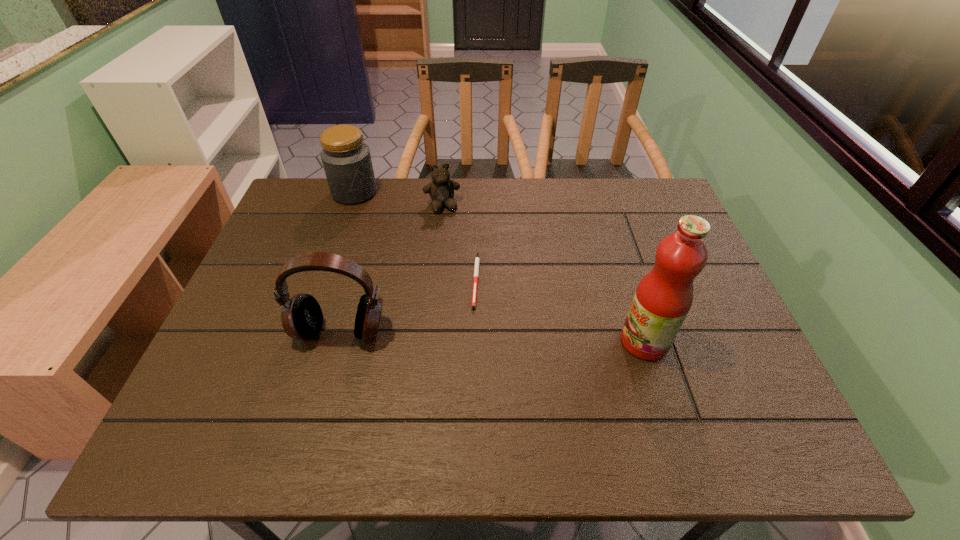
The width and height of the screenshot is (960, 540). I want to click on vacant space on the desktop that is between the headset and the fruit juice and is positioned on the face of the teddy bear, so click(478, 336).

You are a GUI agent. You are given a task and a screenshot of the screen. Output one action in this format:
    pyautogui.click(x=<x>, y=<y>)
    Task: Click on the free spot on the desktop that is between the headset and the tallest object and is positioned on the clicker of the shortest object
    The width and height of the screenshot is (960, 540).
    Given the screenshot: What is the action you would take?
    pyautogui.click(x=518, y=337)

At what (x,y) coordinates should I click in order to perform the action: click on free spot on the desktop that is between the headset and the rightmost object and is positioned on the surface of the jar near the warning symbol. Please return your answer as a coordinate pair (x, y). The image size is (960, 540). Looking at the image, I should click on (452, 335).